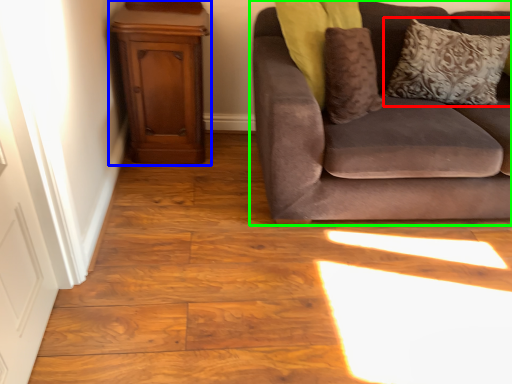
Question: Which object is the closest to the pillow (highlighted by a red box)? Choose among these: dresser (highlighted by a blue box) or studio couch (highlighted by a green box).

Choices:
 (A) dresser
 (B) studio couch

Answer: (B)